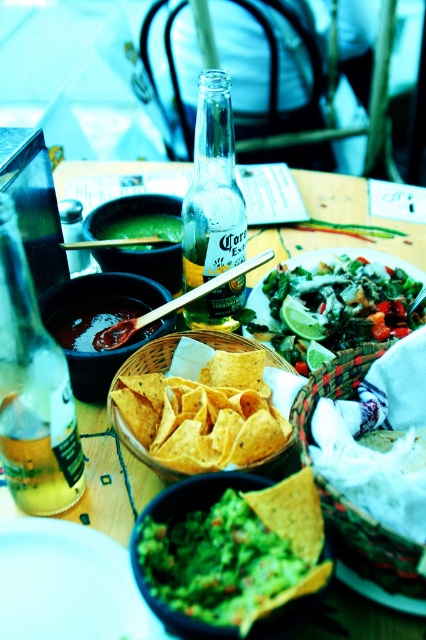
Who is positioned more to the right, green creamy guacamole at center or matte yellow tortilla chips basket at center?

From the viewer's perspective, green creamy guacamole at center appears more on the right side.

Which of these two, green creamy guacamole at center or matte yellow tortilla chips basket at center, stands taller?

Standing taller between the two is matte yellow tortilla chips basket at center.

This screenshot has width=426, height=640. In order to click on green creamy guacamole at center in this screenshot , I will do `click(212, 554)`.

Who is lower down, translucent glass bottle at left or matte green bowl at center?

translucent glass bottle at left is lower down.

Which is more to the right, translucent glass bottle at left or matte green bowl at center?

matte green bowl at center

Locate an element on the screen. This screenshot has width=426, height=640. translucent glass bottle at left is located at coordinates (32, 390).

Can you confirm if matte yellow tortilla chips at center is positioned to the right of dark brown thick soup at center?

Correct, you'll find matte yellow tortilla chips at center to the right of dark brown thick soup at center.

Which is above, matte yellow tortilla chips at center or dark brown thick soup at center?

matte yellow tortilla chips at center is above.

Is point (356, 205) in front of point (68, 317)?

No, (356, 205) is behind (68, 317).

Where is `matte yellow tortilla chips at center`? This screenshot has width=426, height=640. matte yellow tortilla chips at center is located at coordinates (336, 221).